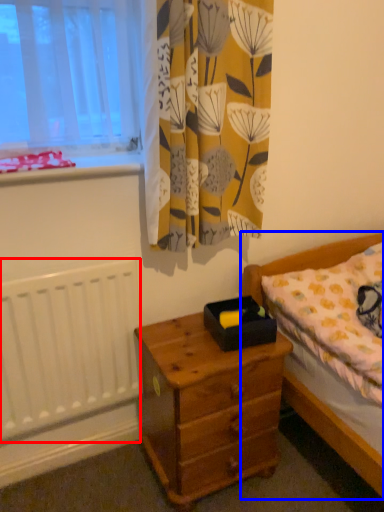
Question: Which object is closer to the camera taking this photo, radiator (highlighted by a red box) or bed (highlighted by a blue box)?

Choices:
 (A) radiator
 (B) bed

Answer: (B)